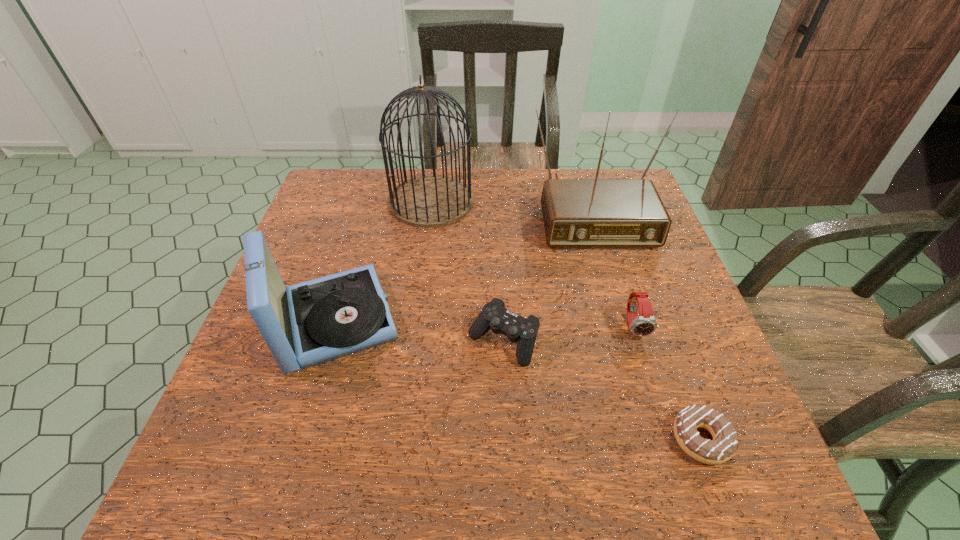
The width and height of the screenshot is (960, 540). I want to click on blank area in the image that satisfies the following two spatial constraints: 1. on the face of the fourth tallest object; 2. on the left side of the doughnut, so click(x=670, y=439).